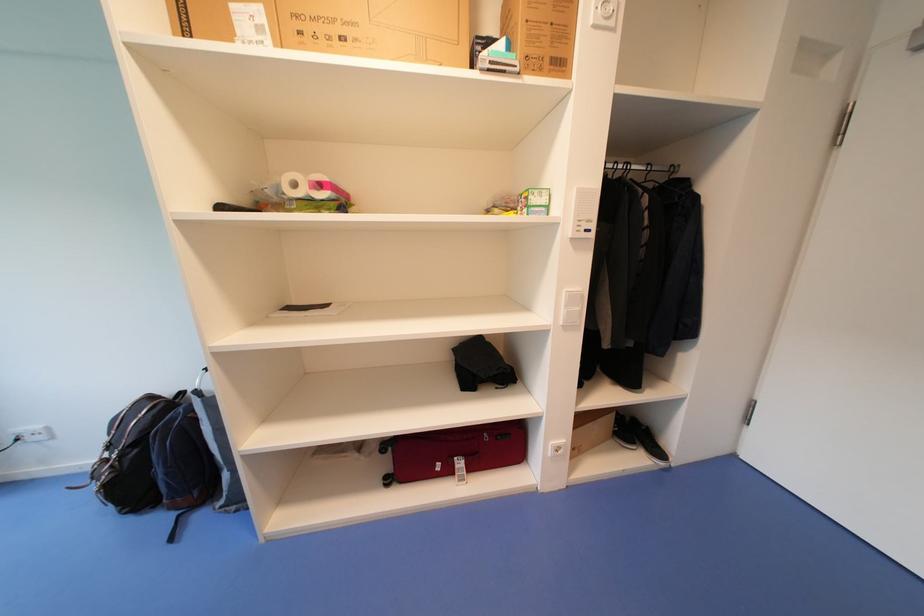
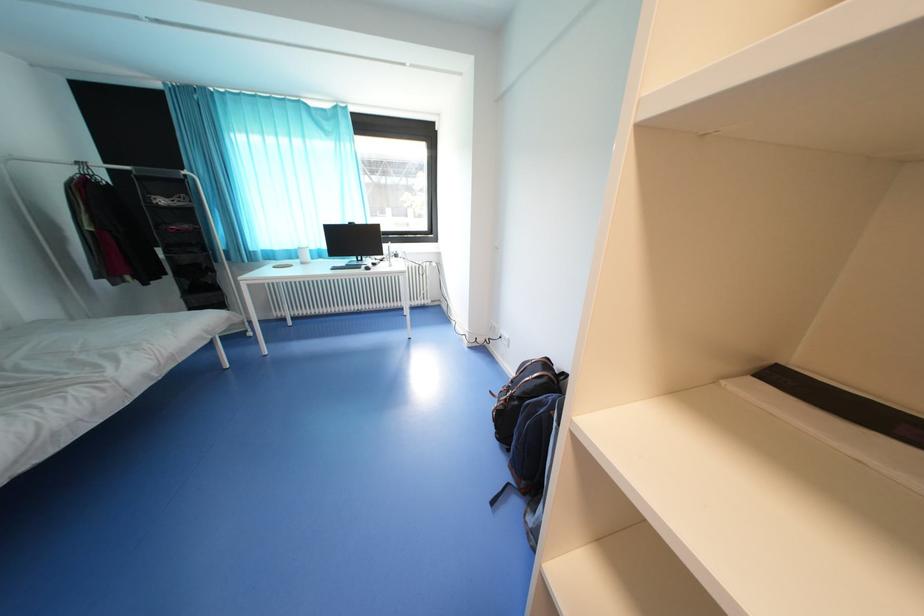
The first image is from the beginning of the video and the second image is from the end. How did the camera likely rotate when shooting the video?

The camera's rotation is toward left-down.